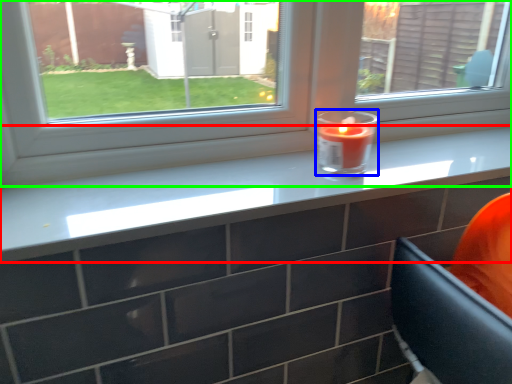
Question: Which object is the farthest from counter top (highlighted by a red box)? Choose among these: birthday candle (highlighted by a blue box) or window (highlighted by a green box).

Choices:
 (A) birthday candle
 (B) window

Answer: (A)